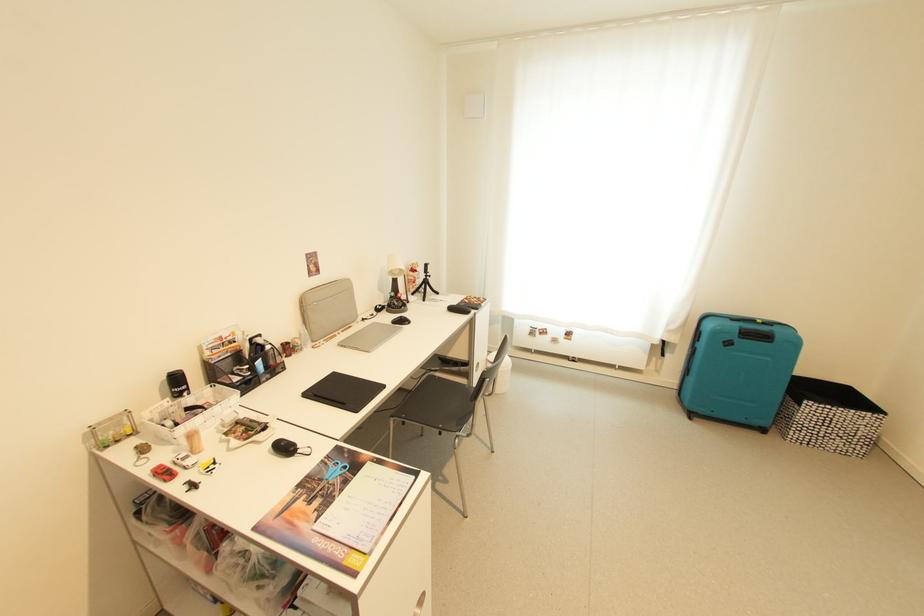
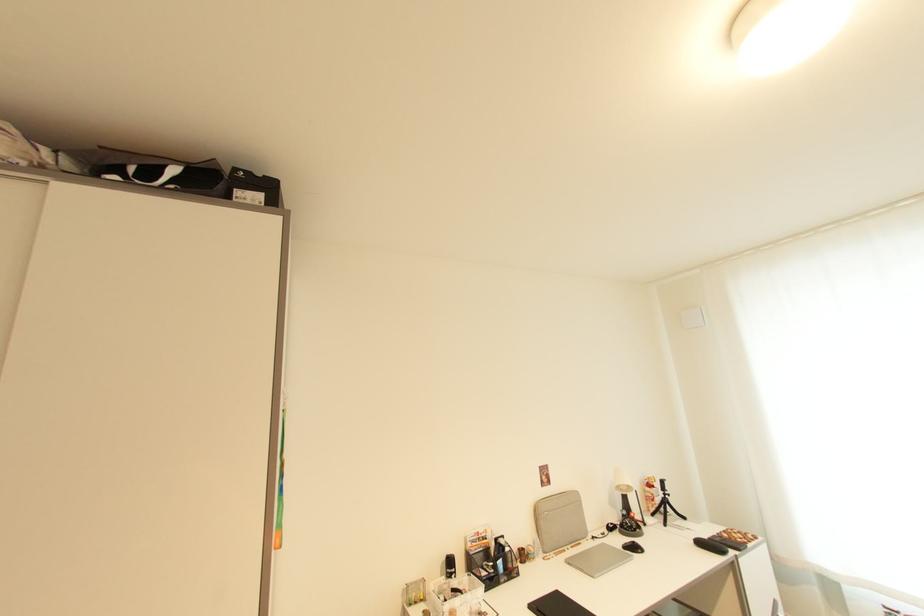
Locate, in the second image, the point that corresponds to [430,278] in the first image.

(669, 498)